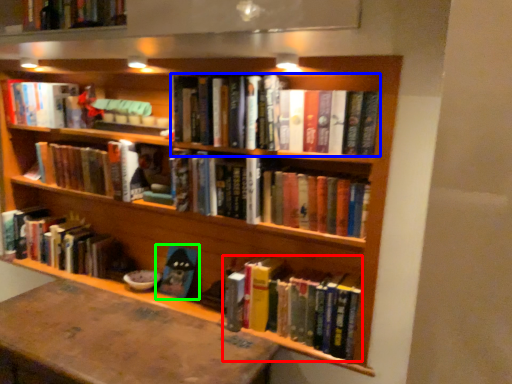
Question: Estimate the real-world distances between objects in this image. Which object is closer to book (highlighted by a red box), book (highlighted by a blue box) or book (highlighted by a green box)?

Choices:
 (A) book
 (B) book

Answer: (B)